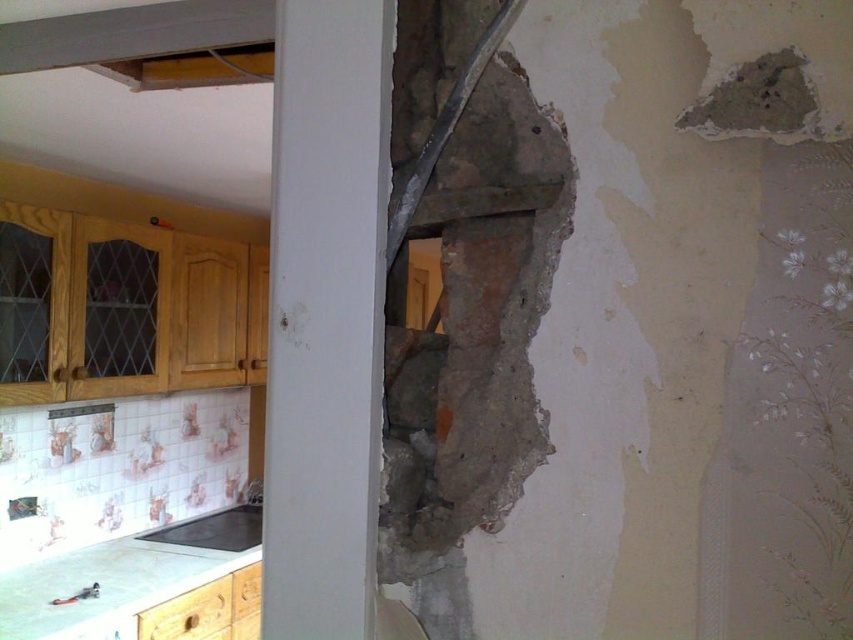
Question: Which point is farther from the camera taking this photo?

Choices:
 (A) (41, 586)
 (B) (242, 547)

Answer: (B)

Question: Is white glossy countertop at lower left smaller than black matte stove at lower left?

Choices:
 (A) no
 (B) yes

Answer: (A)

Question: Is white glossy countertop at lower left to the right of black matte stove at lower left from the viewer's perspective?

Choices:
 (A) yes
 (B) no

Answer: (B)

Question: Considering the relative positions of white glossy countertop at lower left and black matte stove at lower left in the image provided, where is white glossy countertop at lower left located with respect to black matte stove at lower left?

Choices:
 (A) below
 (B) above

Answer: (A)

Question: Which object is closer to the camera taking this photo?

Choices:
 (A) black matte stove at lower left
 (B) white glossy countertop at lower left

Answer: (B)

Question: Which object is farther from the camera taking this photo?

Choices:
 (A) black matte stove at lower left
 (B) white glossy countertop at lower left

Answer: (A)